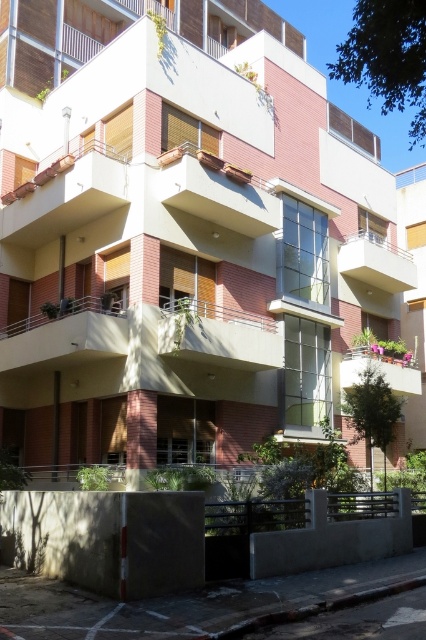
Question: Does white concrete balcony at upper center appear on the left side of matte white balcony at lower right?

Choices:
 (A) no
 (B) yes

Answer: (A)

Question: Can you confirm if white concrete balcony at upper center is wider than matte white balcony at lower right?

Choices:
 (A) yes
 (B) no

Answer: (A)

Question: Estimate the real-world distances between objects in this image. Which object is farther from the smooth concrete balcony at center?

Choices:
 (A) white concrete balcony at upper center
 (B) matte concrete balcony at center
 (C) white concrete balcony at lower left

Answer: (A)

Question: Is smooth concrete balcony at center below white concrete balcony at upper center?

Choices:
 (A) no
 (B) yes

Answer: (B)

Question: Which point appears farthest from the camera in this image?

Choices:
 (A) (345, 244)
 (B) (39, 355)
 (C) (365, 356)
 (D) (210, 362)

Answer: (A)

Question: Which point is farther to the camera?

Choices:
 (A) smooth concrete balcony at center
 (B) matte concrete balcony at center
 (C) white concrete balcony at upper center

Answer: (C)